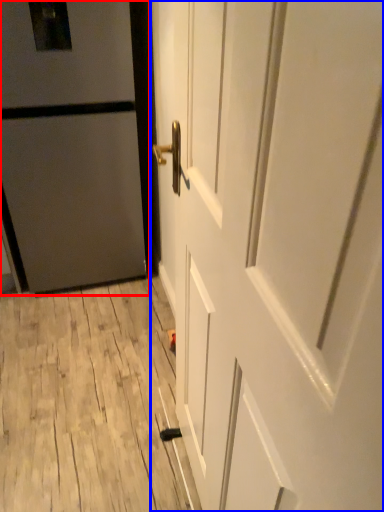
Question: Which object is closer to the camera taking this photo, door (highlighted by a red box) or door (highlighted by a blue box)?

Choices:
 (A) door
 (B) door

Answer: (B)